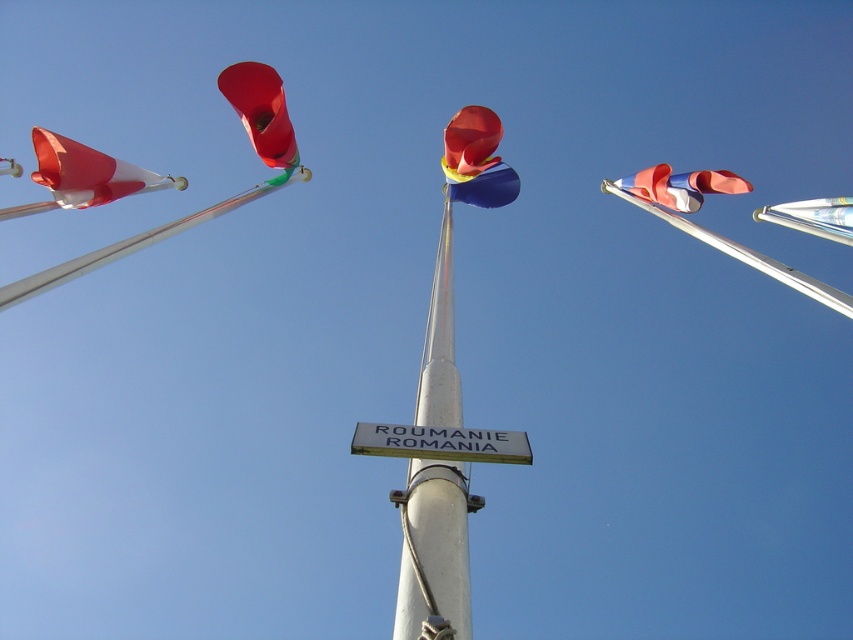
Which is above, metallic silver flag pole at right or matte white flag at right?

matte white flag at right is above.

In the scene shown: Which is more to the right, metallic silver flag pole at right or matte white flag at right?

metallic silver flag pole at right

Who is more forward, (776, 266) or (630, 179)?

Positioned in front is point (776, 266).

This screenshot has width=853, height=640. Find the location of `metallic silver flag pole at right`. metallic silver flag pole at right is located at coordinates (743, 253).

Does matte red flag at upper center have a greater width compared to matte white flag at right?

In fact, matte red flag at upper center might be narrower than matte white flag at right.

Is point (271, 77) less distant than point (689, 177)?

Yes, it is in front of point (689, 177).

At what (x,y) coordinates should I click in order to perform the action: click on matte red flag at upper center. Please return your answer as a coordinate pair (x, y). The image size is (853, 640). Looking at the image, I should click on (260, 109).

Does point (416, 525) lie in front of point (268, 163)?

Yes, it is.

Is point (416, 531) more distant than point (294, 145)?

No, (416, 531) is in front of (294, 145).

The height and width of the screenshot is (640, 853). I want to click on silver metallic pole at center, so pyautogui.click(x=433, y=548).